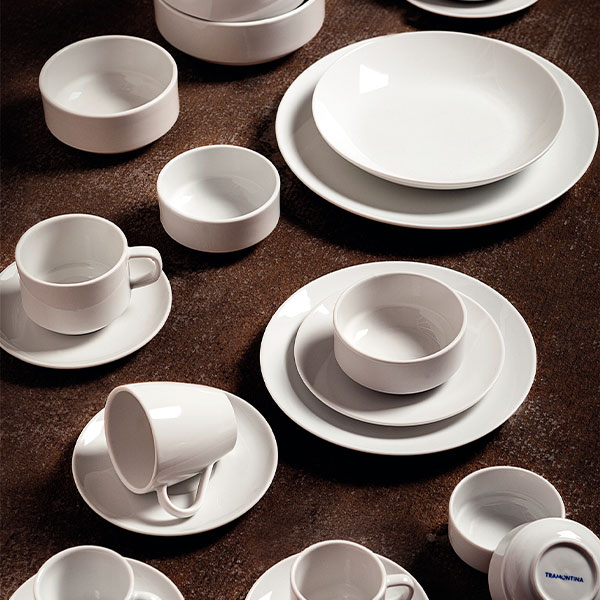
Locate an element on the screen. The height and width of the screenshot is (600, 600). white saucer is located at coordinates (145, 331), (228, 491), (160, 574), (269, 574).